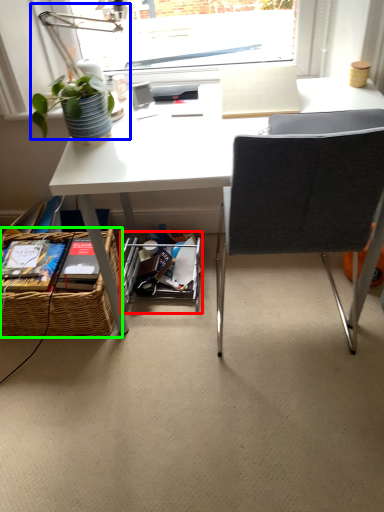
Question: Which object is positioned farthest from shelf (highlighted by a red box)? Select from table lamp (highlighted by a blue box) and picnic basket (highlighted by a green box).

Choices:
 (A) table lamp
 (B) picnic basket

Answer: (A)